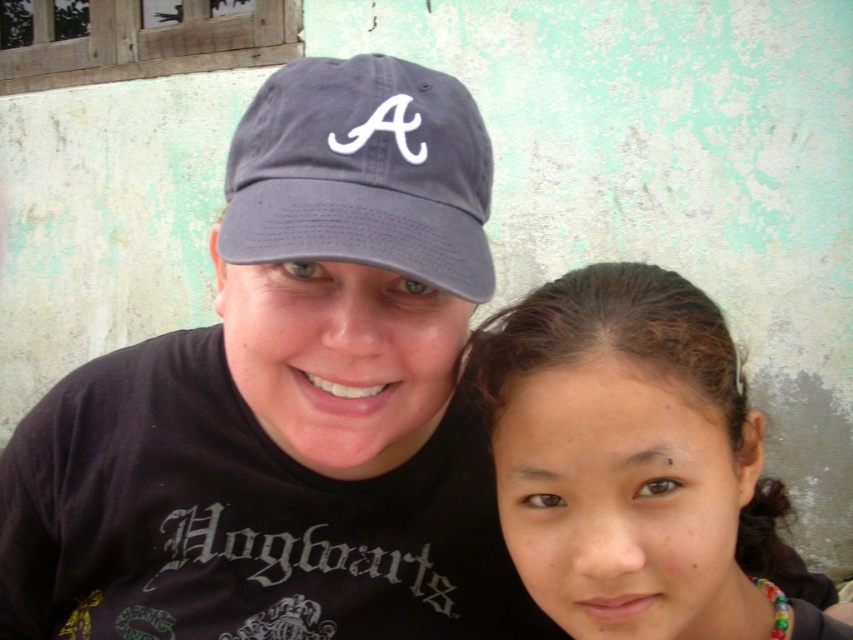
Question: Does brown hair at lower right have a greater width compared to dark gray fabric baseball cap at center?

Choices:
 (A) no
 (B) yes

Answer: (B)

Question: Is brown hair at lower right wider than dark gray fabric baseball cap at center?

Choices:
 (A) yes
 (B) no

Answer: (A)

Question: Which object appears closest to the camera in this image?

Choices:
 (A) dark gray fabric baseball cap at center
 (B) matte gray cap at upper left
 (C) brown hair at lower right

Answer: (A)

Question: Which object is farther from the camera taking this photo?

Choices:
 (A) brown hair at lower right
 (B) dark gray fabric baseball cap at center

Answer: (A)

Question: Which object is closer to the camera taking this photo?

Choices:
 (A) dark gray fabric baseball cap at center
 (B) matte gray cap at upper left
 (C) brown hair at lower right

Answer: (A)

Question: From the image, what is the correct spatial relationship of matte gray cap at upper left in relation to dark gray fabric baseball cap at center?

Choices:
 (A) below
 (B) above

Answer: (A)